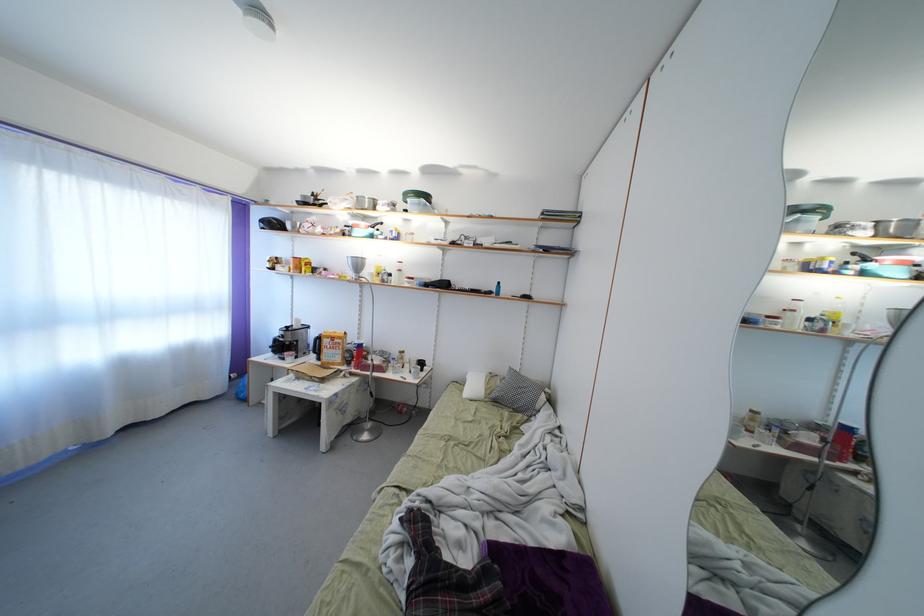
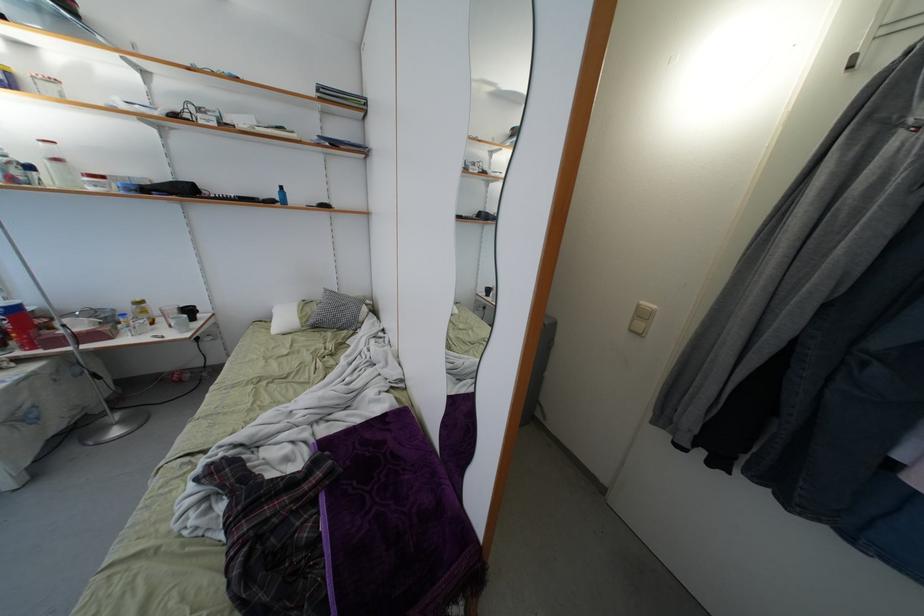
The point at (468, 397) is marked in the first image. Where is the corresponding point in the second image?

(274, 334)